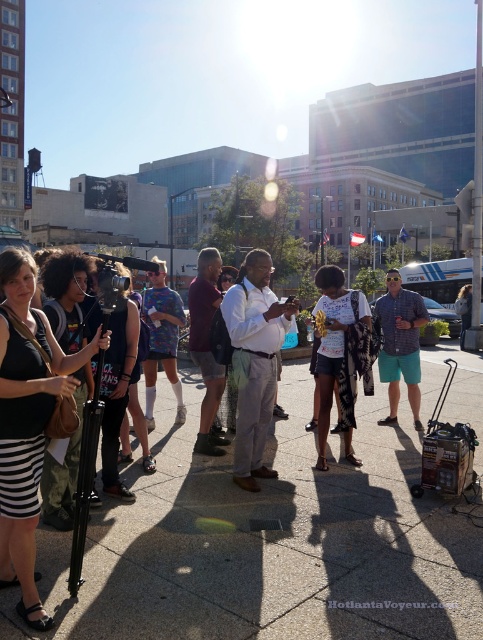
Who is higher up, white shirt at center or printed cotton shirt at center?

Positioned higher is printed cotton shirt at center.

Between point (256, 326) and point (151, 282), which one is positioned in front?

Point (256, 326) is more forward.

Locate an element on the screen. This screenshot has width=483, height=640. white shirt at center is located at coordinates (255, 360).

Can you confirm if gray concrete pavement at center is positioned below white shirt at center?

Yes, gray concrete pavement at center is below white shirt at center.

Does gray concrete pavement at center have a lesser height compared to white shirt at center?

Yes, gray concrete pavement at center is shorter than white shirt at center.

Who is more forward, [161,504] or [243,374]?

Point [161,504]

Locate an element on the screen. Image resolution: width=483 pixels, height=640 pixels. gray concrete pavement at center is located at coordinates (270, 545).

Is white shirt at center taller than maroon fabric shirt at center?

In fact, white shirt at center may be shorter than maroon fabric shirt at center.

Consider the image. Is white shirt at center closer to camera compared to maroon fabric shirt at center?

Yes, it is.

Is point (272, 376) farther from camera compared to point (210, 320)?

No, (272, 376) is closer to viewer.

At what (x,y) coordinates should I click in order to perform the action: click on white shirt at center. Please return your answer as a coordinate pair (x, y). Looking at the image, I should click on (255, 360).